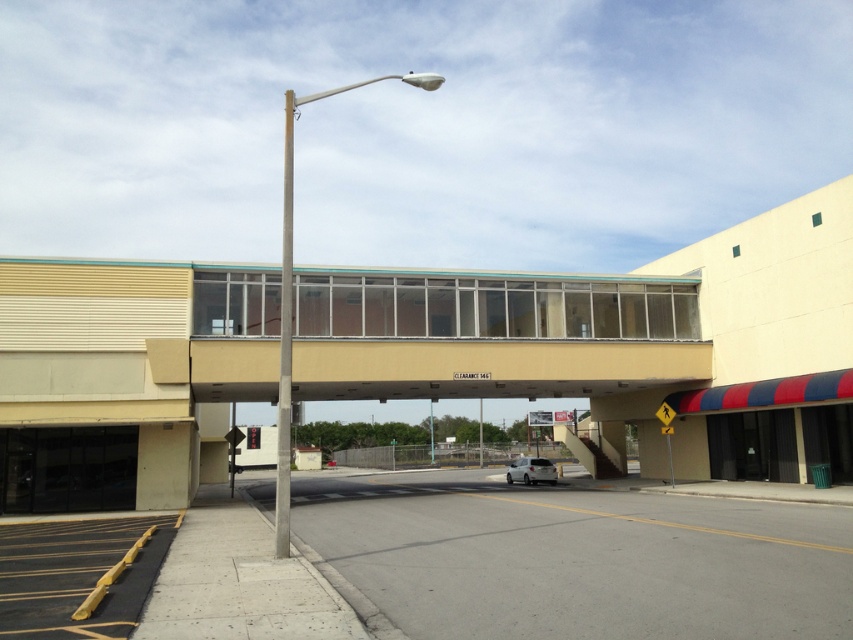
Can you confirm if silver metallic pole at center is positioned above gray concrete pole at center?

Indeed, silver metallic pole at center is positioned over gray concrete pole at center.

Does silver metallic pole at center have a lesser height compared to gray concrete pole at center?

In fact, silver metallic pole at center may be taller than gray concrete pole at center.

Where is `silver metallic pole at center`? The width and height of the screenshot is (853, 640). silver metallic pole at center is located at coordinates (291, 296).

Does beige matte overpass at center have a smaller size compared to gray concrete pole at center?

Yes, beige matte overpass at center is smaller than gray concrete pole at center.

Is beige matte overpass at center bigger than gray concrete pole at center?

No.

Does point (456, 349) come in front of point (289, 292)?

No, it is not.

What are the coordinates of `beige matte overpass at center` in the screenshot? It's located at (489, 337).

Measure the distance between gray concrete pole at center and white matte car at center.

gray concrete pole at center and white matte car at center are 50.55 meters apart from each other.

Is gray concrete pole at center in front of white matte car at center?

That is True.

Image resolution: width=853 pixels, height=640 pixels. Identify the location of gray concrete pole at center. (285, 342).